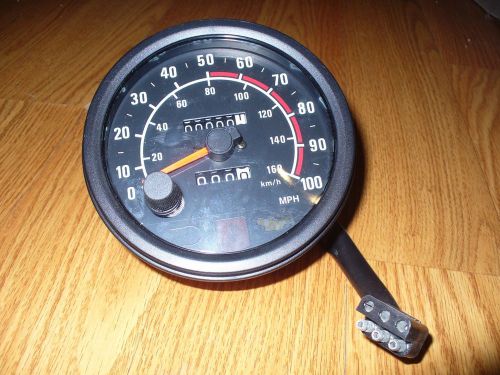
You are a GUI agent. You are given a task and a screenshot of the screen. Output one action in this format:
    pyautogui.click(x=<x>, y=<y>)
    Task: Click on the light reflections
    Image resolution: width=500 pixels, height=375 pixels.
    Given the screenshot: What is the action you would take?
    pyautogui.click(x=217, y=269), pyautogui.click(x=104, y=339), pyautogui.click(x=216, y=239)